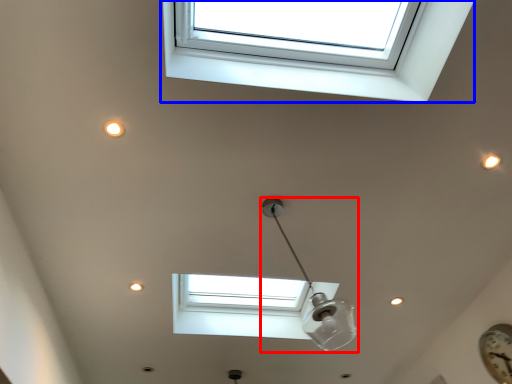
Question: Among these objects, which one is nearest to the camera, lamp (highlighted by a red box) or window (highlighted by a blue box)?

Choices:
 (A) lamp
 (B) window

Answer: (B)